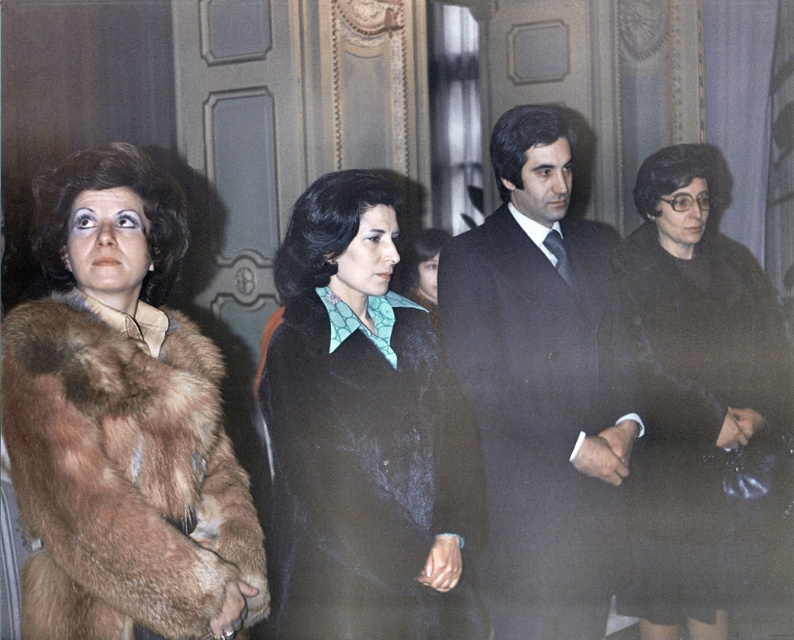
Can you confirm if velvet black coat at center is positioned above velvet teal blouse at center?

Incorrect, velvet black coat at center is not positioned above velvet teal blouse at center.

Does velvet black coat at center have a lesser height compared to velvet teal blouse at center?

Incorrect, velvet black coat at center's height does not fall short of velvet teal blouse at center's.

Who is more distant from viewer, (434, 483) or (437, 252)?

Point (437, 252)

This screenshot has width=794, height=640. Find the location of `velvet black coat at center`. velvet black coat at center is located at coordinates (361, 435).

Is black wool coat at center positioned in front of velvet teal blouse at center?

Yes, black wool coat at center is in front of velvet teal blouse at center.

Who is more forward, (744, 316) or (405, 262)?

Point (744, 316)

This screenshot has width=794, height=640. Find the location of `black wool coat at center`. black wool coat at center is located at coordinates (696, 397).

Can you confirm if dark suit at center is wider than velvet teal blouse at center?

Yes, dark suit at center is wider than velvet teal blouse at center.

Is dark suit at center shorter than velvet teal blouse at center?

Incorrect, dark suit at center's height does not fall short of velvet teal blouse at center's.

This screenshot has width=794, height=640. I want to click on dark suit at center, so click(x=542, y=385).